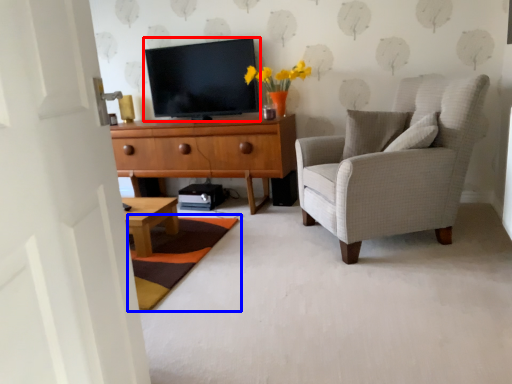
Question: Among these objects, which one is farthest to the camera, television (highlighted by a red box) or mat (highlighted by a blue box)?

Choices:
 (A) television
 (B) mat

Answer: (A)